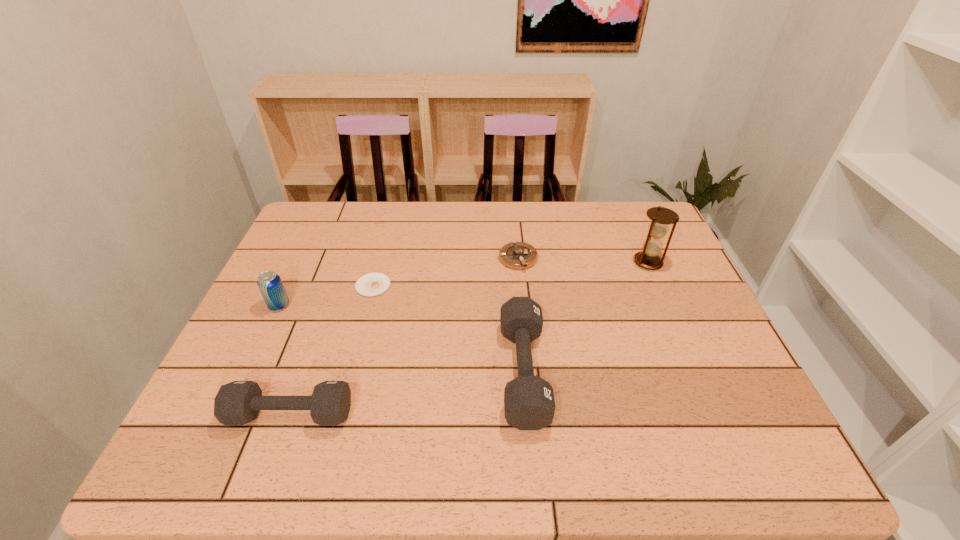
The width and height of the screenshot is (960, 540). In order to click on vacant space positioned 0.220m on the right of the right dumbbell in this screenshot , I will do `click(640, 372)`.

This screenshot has height=540, width=960. I want to click on vacant region located 0.190m on the back of the shortest object, so click(x=387, y=235).

This screenshot has height=540, width=960. What are the coordinates of `free location located on the back of the ashtray` in the screenshot? It's located at (516, 229).

Where is `free spot located 0.130m on the front of the beer can`? free spot located 0.130m on the front of the beer can is located at coordinates (257, 353).

You are a GUI agent. You are given a task and a screenshot of the screen. Output one action in this format:
    pyautogui.click(x=<x>, y=<y>)
    Task: Click on the vacant area located on the back of the rightmost object
    The image size is (960, 540).
    Given the screenshot: What is the action you would take?
    [x=637, y=239]

Where is `dumbbell that is positioned at the left edge`? The width and height of the screenshot is (960, 540). dumbbell that is positioned at the left edge is located at coordinates (237, 403).

This screenshot has width=960, height=540. What are the coordinates of `beer can positioned at the left edge` in the screenshot? It's located at (270, 284).

Find the location of a particular element. object that is at the right edge is located at coordinates (661, 217).

This screenshot has height=540, width=960. What are the coordinates of `object situated at the near left corner` in the screenshot? It's located at (237, 403).

This screenshot has height=540, width=960. In the image, there is a desktop. Find the location of `vacant space at the far edge`. vacant space at the far edge is located at coordinates (428, 201).